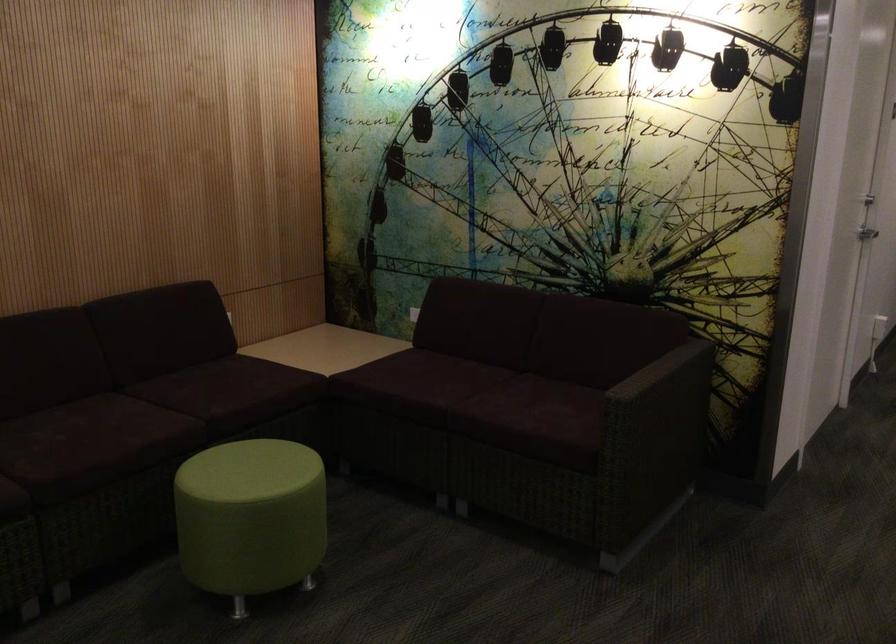
Where is `silver door handle`? The height and width of the screenshot is (644, 896). silver door handle is located at coordinates (866, 232).